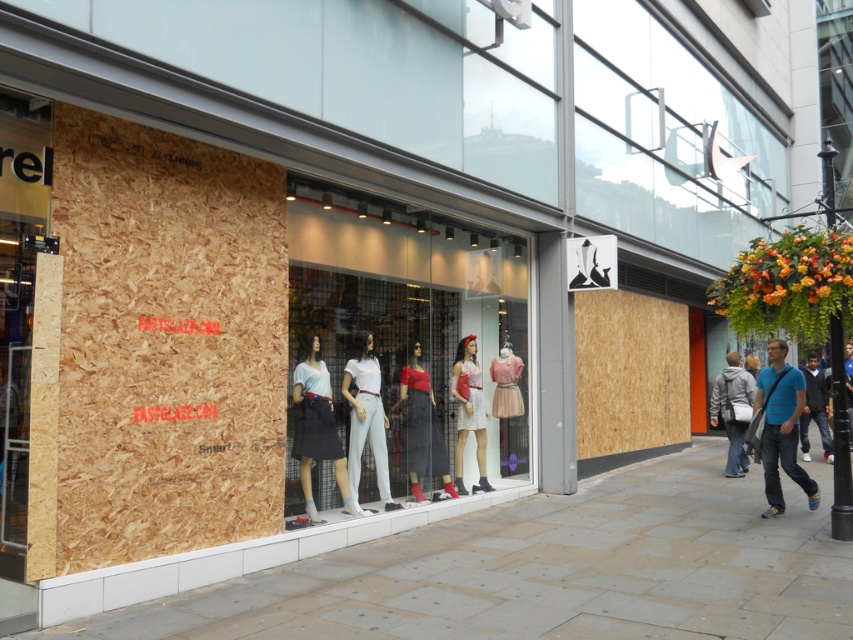
You are a customer looking at the mannequins in the store. There is a point marked at coordinates [366,420]. Which item is this point located on?

The point at coordinates [366,420] is located on the white matte t shirt at center.

You are a customer looking at the store window. Where exactly is the blue striped shirt at lower right located in the store window?

The blue striped shirt at lower right is located at point (781, 426) in the store window.